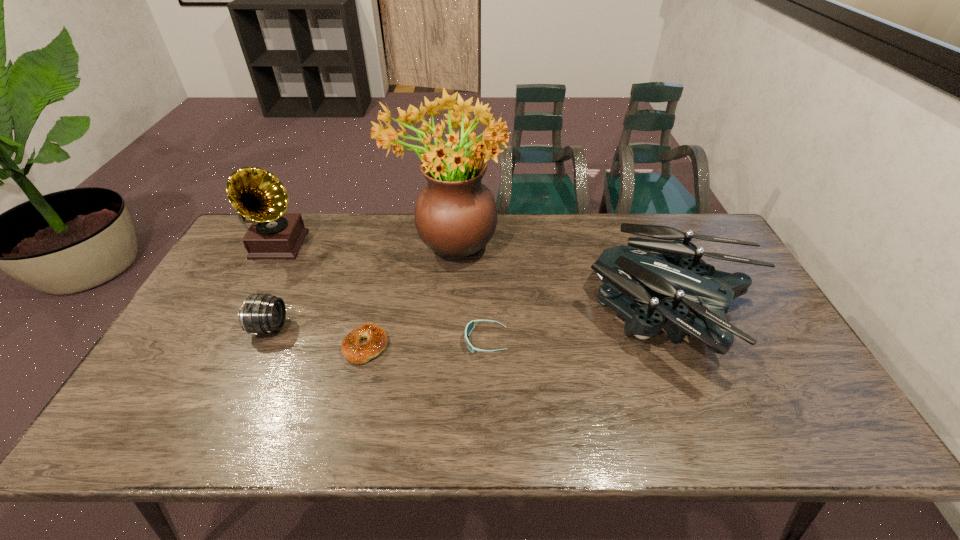
The width and height of the screenshot is (960, 540). Find the location of `vacant area at the far edge`. vacant area at the far edge is located at coordinates (391, 238).

Where is `vacant space at the near edge of the desktop`? The height and width of the screenshot is (540, 960). vacant space at the near edge of the desktop is located at coordinates (677, 420).

You are a GUI agent. You are given a task and a screenshot of the screen. Output one action in this format:
    pyautogui.click(x=<x>, y=<y>)
    Task: Click on the blank space at the left edge
    
    Given the screenshot: What is the action you would take?
    pyautogui.click(x=268, y=261)

Where is `vacant space at the right edge`? vacant space at the right edge is located at coordinates (775, 322).

Find the location of `vacant point at the near left corner`. vacant point at the near left corner is located at coordinates (132, 420).

This screenshot has width=960, height=540. I want to click on unoccupied position between the flower arrangement and the drone, so (x=561, y=281).

The image size is (960, 540). I want to click on vacant space that is in between the flower arrangement and the drone, so click(x=561, y=281).

In order to click on vacant region between the flower arrangement and the telephoto lens in this screenshot , I will do `click(358, 286)`.

I want to click on free space between the fifth shortest object and the telephoto lens, so click(274, 286).

I want to click on vacant space that is in between the telephoto lens and the phonograph record, so click(274, 286).